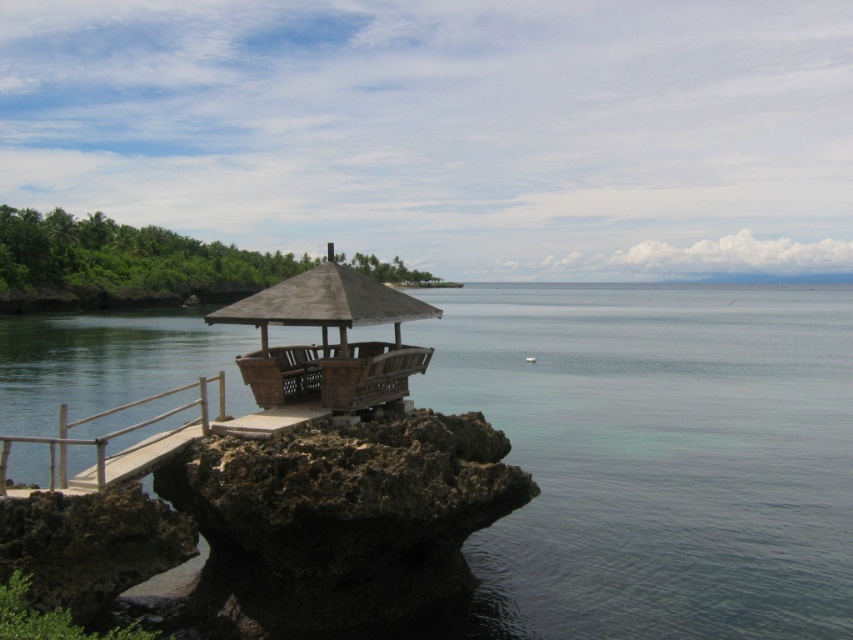
Question: Which object is closer to the camera taking this photo?

Choices:
 (A) wooden gazebo at center
 (B) white wood rail at lower left

Answer: (B)

Question: Does clear blue water at center come in front of white wood rail at lower left?

Choices:
 (A) yes
 (B) no

Answer: (B)

Question: Is wooden gazebo at center positioned in front of white wood rail at lower left?

Choices:
 (A) yes
 (B) no

Answer: (B)

Question: Can you confirm if clear blue water at center is positioned above white wood rail at lower left?

Choices:
 (A) yes
 (B) no

Answer: (A)

Question: Which object is positioned closest to the white wood rail at lower left?

Choices:
 (A) wooden gazebo at center
 (B) clear blue water at center

Answer: (A)

Question: Which object is positioned closest to the wooden gazebo at center?

Choices:
 (A) white wood rail at lower left
 (B) clear blue water at center

Answer: (A)